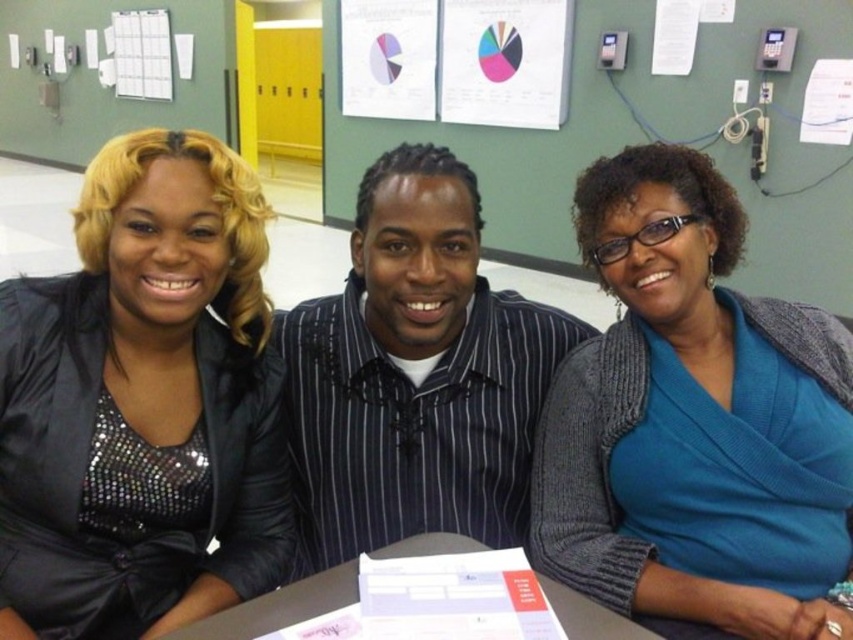
Question: Can you confirm if blue knit sweater at center is positioned to the left of white paper at center?

Choices:
 (A) no
 (B) yes

Answer: (A)

Question: Is satin black jacket at left above black pinstripe shirt at center?

Choices:
 (A) yes
 (B) no

Answer: (A)

Question: Which point appears farthest from the camera in this image?

Choices:
 (A) (163, 458)
 (B) (460, 237)
 (C) (225, 612)

Answer: (B)

Question: Which is farther from the blue knit sweater at center?

Choices:
 (A) satin black jacket at left
 (B) black pinstripe shirt at center
 (C) white paper at center

Answer: (A)

Question: Which point is closer to the camera?

Choices:
 (A) (503, 525)
 (B) (601, 472)
 (C) (555, 604)
 (D) (225, 556)

Answer: (C)

Question: Does blue knit sweater at center appear over black pinstripe shirt at center?

Choices:
 (A) yes
 (B) no

Answer: (A)